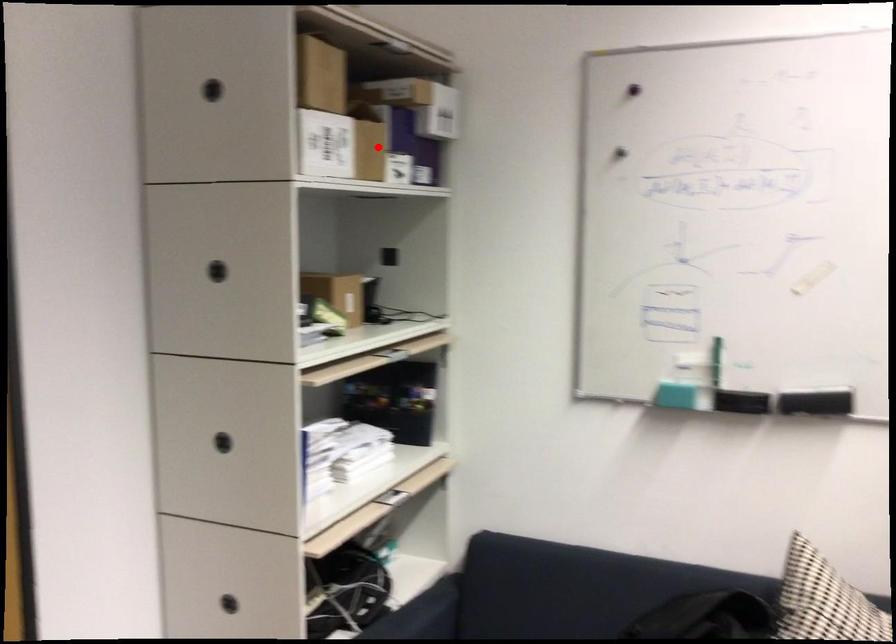
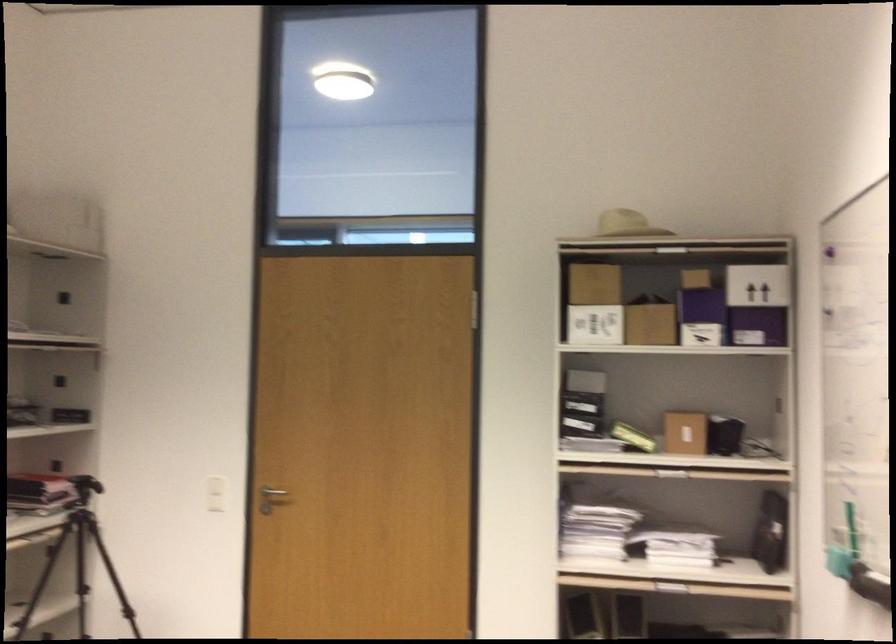
In the second image, find the point that corresponds to the highlighted location in the first image.

(702, 317)